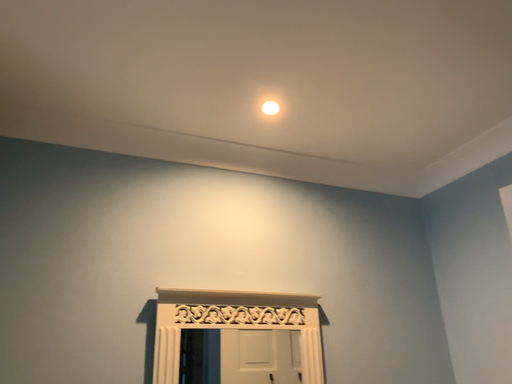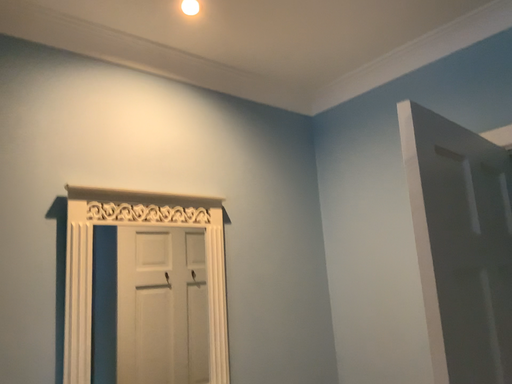
Question: How did the camera likely rotate when shooting the video?

Choices:
 (A) rotated upward
 (B) rotated downward

Answer: (B)